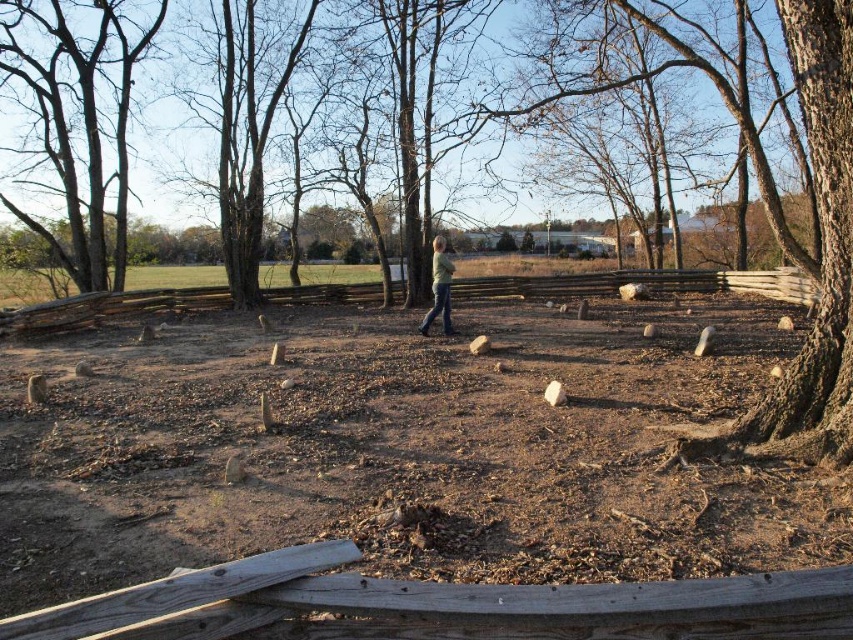
In the scene shown: How far apart are brown dirt field at center and green matte jacket at center?

brown dirt field at center is 18.34 feet away from green matte jacket at center.

Who is shorter, brown dirt field at center or green matte jacket at center?

Standing shorter between the two is green matte jacket at center.

Which is behind, point (556, 401) or point (451, 262)?

The point (451, 262) is more distant.

Image resolution: width=853 pixels, height=640 pixels. Identify the location of brown dirt field at center. (412, 481).

Does smooth gray bark at upper left appear on the left side of green matte jacket at center?

Indeed, smooth gray bark at upper left is positioned on the left side of green matte jacket at center.

Who is more distant from viewer, (x=38, y=51) or (x=434, y=305)?

The point (x=38, y=51) is behind.

Who is more distant from viewer, (83, 102) or (453, 266)?

Point (83, 102)

Locate an element on the screen. This screenshot has height=640, width=853. smooth gray bark at upper left is located at coordinates (77, 116).

Is brown dirt field at center taller than smooth gray bark at upper left?

Yes.

Is brown dirt field at center shorter than smooth gray bark at upper left?

No.

Image resolution: width=853 pixels, height=640 pixels. In order to click on brown dirt field at center in this screenshot , I will do `click(412, 481)`.

You are a GUI agent. You are given a task and a screenshot of the screen. Output one action in this format:
    pyautogui.click(x=<x>, y=<y>)
    Task: Click on the brown dirt field at center
    
    Given the screenshot: What is the action you would take?
    pyautogui.click(x=412, y=481)